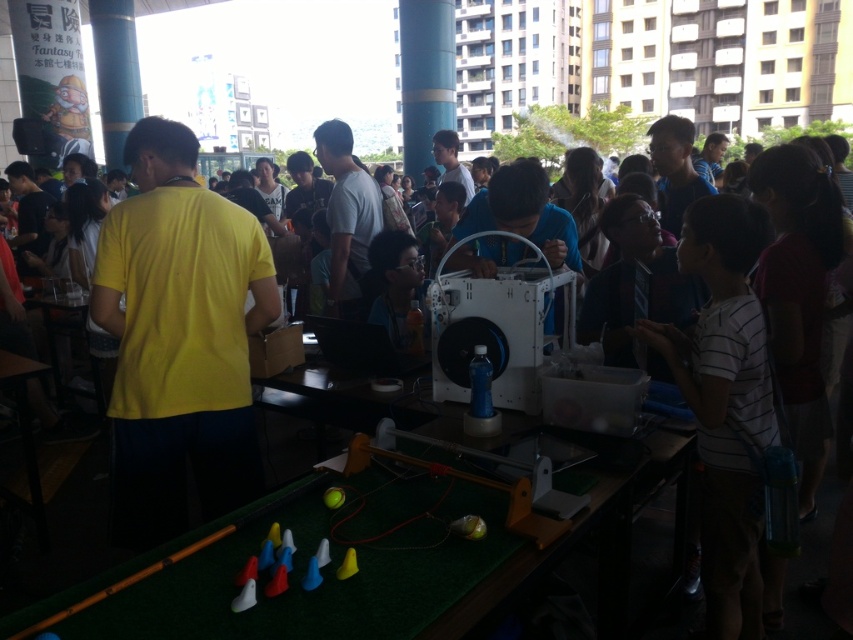
You are organizing a photo shoot and need to decide which shirt to use as the main focus. Given that you want the shirt to be clearly visible in the photo, which one between the yellow matte shirt at center and the white striped shirt at center should you choose and why?

The yellow matte shirt at center is bigger than the white striped shirt at center, so it would be more visible and suitable as the main focus in the photo.

You are a photographer at the event and need to take a closeup shot of the yellow matte shirt at center. Your camera has a minimum focusing distance of 7 feet. Can you take the photo without moving either the camera or the subject?

The yellow matte shirt at center and camera are 7.44 feet apart. Since the minimum focusing distance is 7 feet, the camera can focus as the distance is within range. However, to get a closeup, you might need to use a macro lens or adjust your camera settings for closer focus.